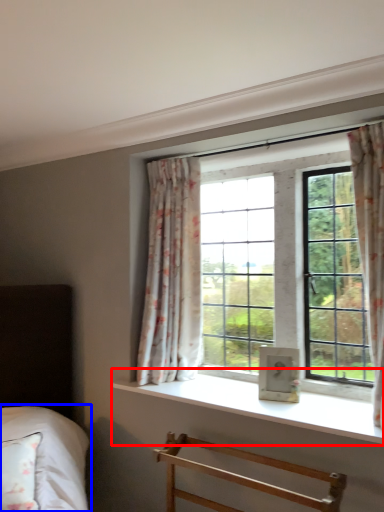
Question: Which of the following is the closest to the observer, window sill (highlighted by a red box) or bed (highlighted by a blue box)?

Choices:
 (A) window sill
 (B) bed

Answer: (A)